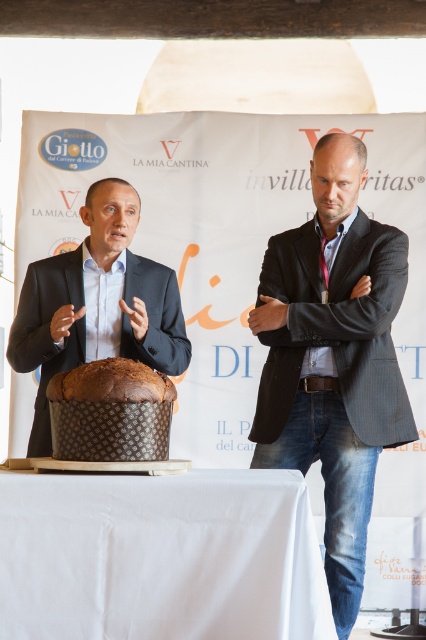
Can you confirm if black pinstripe blazer at center is wider than brown textured bread at center?

Yes, black pinstripe blazer at center is wider than brown textured bread at center.

Consider the image. Does black pinstripe blazer at center have a greater height compared to brown textured bread at center?

Yes, black pinstripe blazer at center is taller than brown textured bread at center.

Is point (299, 280) positioned in front of point (52, 387)?

No, it is not.

Locate an element on the screen. This screenshot has height=640, width=426. black pinstripe blazer at center is located at coordinates (336, 328).

Which is below, white cloth at lower center or black pinstripe blazer at center?

white cloth at lower center is lower down.

Locate an element on the screen. This screenshot has height=640, width=426. white cloth at lower center is located at coordinates (161, 556).

The image size is (426, 640). I want to click on white cloth at lower center, so click(x=161, y=556).

You are a GUI agent. You are given a task and a screenshot of the screen. Output one action in this format:
    pyautogui.click(x=<x>, y=<y>)
    Task: Click on the white cloth at lower center
    The image size is (426, 640).
    Given the screenshot: What is the action you would take?
    161,556

Does matte black suit at center appear under brown textured bread at center?

Actually, matte black suit at center is above brown textured bread at center.

Does matte black suit at center appear over brown textured bread at center?

Yes.

Does point (25, 324) lie behind point (149, 387)?

Yes, it is behind point (149, 387).

Image resolution: width=426 pixels, height=640 pixels. I want to click on matte black suit at center, so click(x=97, y=305).